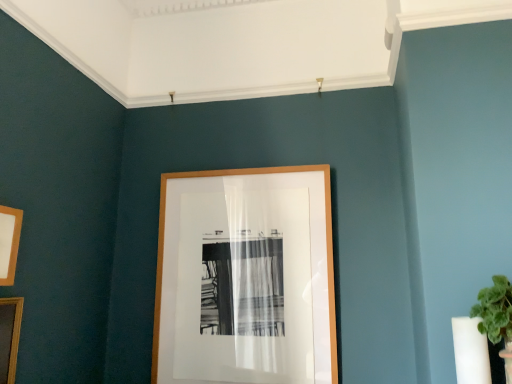
The image size is (512, 384). I want to click on wooden picture frame at left, acting as the second picture frame starting from the front, so click(9, 243).

In order to click on wooden picture frame at left, the 2th picture frame in the left-to-right sequence in this screenshot , I will do `click(9, 243)`.

Is point (2, 354) positioned before point (200, 354)?

That is True.

Is wooden picture frame at lower left, the first picture frame positioned from the left, not near wooden picture frame at center, which ranks as the 1th picture frame in back-to-front order?

wooden picture frame at lower left, the first picture frame positioned from the left, is actually quite close to wooden picture frame at center, which ranks as the 1th picture frame in back-to-front order.

From the image's perspective, is wooden picture frame at lower left, which appears as the 3th picture frame when viewed from the right, below wooden picture frame at center, the 1th picture frame viewed from the right?

Yes, from the image's perspective, wooden picture frame at lower left, which appears as the 3th picture frame when viewed from the right, is below wooden picture frame at center, the 1th picture frame viewed from the right.

Looking at the image, does wooden picture frame at lower left, which appears as the 3th picture frame when viewed from the right, seem bigger or smaller compared to wooden picture frame at center, which ranks as the 1th picture frame in back-to-front order?

Clearly, wooden picture frame at lower left, which appears as the 3th picture frame when viewed from the right, is smaller in size than wooden picture frame at center, which ranks as the 1th picture frame in back-to-front order.

From the image's perspective, starting from the wooden picture frame at lower left, the first picture frame positioned from the left, which picture frame is the 1st one above? Please provide its 2D coordinates.

[(245, 278)]

From the image's perspective, is wooden picture frame at center, the 1th picture frame viewed from the right, located beneath wooden picture frame at lower left, which appears as the 3th picture frame when viewed from the right?

Incorrect, from the image's perspective, wooden picture frame at center, the 1th picture frame viewed from the right, is higher than wooden picture frame at lower left, which appears as the 3th picture frame when viewed from the right.

Consider the image. From a real-world perspective, who is located lower, wooden picture frame at center, which ranks as the 1th picture frame in back-to-front order, or wooden picture frame at lower left, which is the first picture frame from front to back?

In real-world perspective, wooden picture frame at lower left, which is the first picture frame from front to back, is lower.

From the image's perspective, is wooden picture frame at center, marked as the 3th picture frame in a front-to-back arrangement, over wooden picture frame at left, acting as the second picture frame starting from the back?

No, from the image's perspective, wooden picture frame at center, marked as the 3th picture frame in a front-to-back arrangement, is not above wooden picture frame at left, acting as the second picture frame starting from the back.

Based on the photo, is wooden picture frame at left, the 2th picture frame in the left-to-right sequence, at the back of wooden picture frame at center, positioned as the third picture frame in left-to-right order?

No, wooden picture frame at center, positioned as the third picture frame in left-to-right order, is not facing the opposite direction of wooden picture frame at left, the 2th picture frame in the left-to-right sequence.

Is wooden picture frame at center, which ranks as the 1th picture frame in back-to-front order, to the left of wooden picture frame at left, the 2th picture frame in the left-to-right sequence, from the viewer's perspective?

Incorrect, wooden picture frame at center, which ranks as the 1th picture frame in back-to-front order, is not on the left side of wooden picture frame at left, the 2th picture frame in the left-to-right sequence.

Based on the photo, is wooden picture frame at center, the 1th picture frame viewed from the right, surrounding wooden picture frame at left, acting as the second picture frame starting from the front?

No.

From the image's perspective, is wooden picture frame at left, acting as the second picture frame starting from the front, above wooden picture frame at center, positioned as the third picture frame in left-to-right order?

Indeed, from the image's perspective, wooden picture frame at left, acting as the second picture frame starting from the front, is shown above wooden picture frame at center, positioned as the third picture frame in left-to-right order.

From a real-world perspective, which is physically above, wooden picture frame at left, the 2th picture frame in the left-to-right sequence, or wooden picture frame at center, which ranks as the 1th picture frame in back-to-front order?

In real-world perspective, wooden picture frame at left, the 2th picture frame in the left-to-right sequence, is above.

This screenshot has width=512, height=384. In the image, there is a wooden picture frame at center, positioned as the third picture frame in left-to-right order. In order to click on picture frame above it (from the image's perspective) in this screenshot , I will do `click(9, 243)`.

Considering the positions of point (21, 218) and point (294, 254), is point (21, 218) closer or farther from the camera than point (294, 254)?

Clearly, point (21, 218) is closer to the camera than point (294, 254).

From a real-world perspective, who is located lower, wooden picture frame at left, which is the second picture frame in right-to-left order, or wooden picture frame at lower left, the first picture frame positioned from the left?

wooden picture frame at lower left, the first picture frame positioned from the left.

Considering the relative positions of wooden picture frame at left, which is the second picture frame in right-to-left order, and wooden picture frame at lower left, which appears as the 3th picture frame when viewed from the right, in the image provided, is wooden picture frame at left, which is the second picture frame in right-to-left order, behind wooden picture frame at lower left, which appears as the 3th picture frame when viewed from the right,?

Yes, the depth of wooden picture frame at left, which is the second picture frame in right-to-left order, is greater than that of wooden picture frame at lower left, which appears as the 3th picture frame when viewed from the right.

Which is more to the right, wooden picture frame at left, acting as the second picture frame starting from the back, or wooden picture frame at lower left, which appears as the 3th picture frame when viewed from the right?

From the viewer's perspective, wooden picture frame at left, acting as the second picture frame starting from the back, appears more on the right side.

Are wooden picture frame at left, acting as the second picture frame starting from the front, and wooden picture frame at lower left, which is counted as the 3th picture frame, starting from the back, far apart?

No, wooden picture frame at left, acting as the second picture frame starting from the front, is in close proximity to wooden picture frame at lower left, which is counted as the 3th picture frame, starting from the back.

Would you say wooden picture frame at lower left, which is the first picture frame from front to back, is outside wooden picture frame at left, acting as the second picture frame starting from the front?

Yes, wooden picture frame at lower left, which is the first picture frame from front to back, is located beyond the bounds of wooden picture frame at left, acting as the second picture frame starting from the front.

From a real-world perspective, is wooden picture frame at lower left, which is the first picture frame from front to back, below wooden picture frame at left, the 2th picture frame in the left-to-right sequence?

Yes, from a real-world perspective, wooden picture frame at lower left, which is the first picture frame from front to back, is under wooden picture frame at left, the 2th picture frame in the left-to-right sequence.

Considering the sizes of objects wooden picture frame at lower left, which is the first picture frame from front to back, and wooden picture frame at left, which is the second picture frame in right-to-left order, in the image provided, who is taller, wooden picture frame at lower left, which is the first picture frame from front to back, or wooden picture frame at left, which is the second picture frame in right-to-left order,?

Standing taller between the two is wooden picture frame at lower left, which is the first picture frame from front to back.

In the scene shown: Can you confirm if wooden picture frame at lower left, which appears as the 3th picture frame when viewed from the right, is positioned to the right of wooden picture frame at left, the 2th picture frame in the left-to-right sequence?

No.

Find the location of `picture frame below the wooden picture frame at center, positioned as the third picture frame in left-to-right order (from a real-world perspective)`. picture frame below the wooden picture frame at center, positioned as the third picture frame in left-to-right order (from a real-world perspective) is located at coordinates (9, 337).

Find the location of a particular element. The height and width of the screenshot is (384, 512). the 2nd picture frame to the right of the wooden picture frame at lower left, which is counted as the 3th picture frame, starting from the back, starting your count from the anchor is located at coordinates (245, 278).

When comparing their distances from wooden picture frame at lower left, which is counted as the 3th picture frame, starting from the back, does wooden picture frame at center, marked as the 3th picture frame in a front-to-back arrangement, or wooden picture frame at left, the 2th picture frame in the left-to-right sequence, seem further?

wooden picture frame at center, marked as the 3th picture frame in a front-to-back arrangement, is positioned further to the anchor wooden picture frame at lower left, which is counted as the 3th picture frame, starting from the back.

From the image, which object appears to be farther from wooden picture frame at left, acting as the second picture frame starting from the back, wooden picture frame at lower left, which is counted as the 3th picture frame, starting from the back, or wooden picture frame at center, marked as the 3th picture frame in a front-to-back arrangement?

The object further to wooden picture frame at left, acting as the second picture frame starting from the back, is wooden picture frame at center, marked as the 3th picture frame in a front-to-back arrangement.

Looking at the image, which one is located closer to wooden picture frame at lower left, the first picture frame positioned from the left, wooden picture frame at left, the 2th picture frame in the left-to-right sequence, or wooden picture frame at center, positioned as the third picture frame in left-to-right order?

wooden picture frame at left, the 2th picture frame in the left-to-right sequence.

When comparing their distances from wooden picture frame at center, positioned as the third picture frame in left-to-right order, does wooden picture frame at left, acting as the second picture frame starting from the back, or wooden picture frame at lower left, which is counted as the 3th picture frame, starting from the back, seem further?

Based on the image, wooden picture frame at left, acting as the second picture frame starting from the back, appears to be further to wooden picture frame at center, positioned as the third picture frame in left-to-right order.

From the image, which object appears to be farther from wooden picture frame at left, acting as the second picture frame starting from the back, wooden picture frame at center, which ranks as the 1th picture frame in back-to-front order, or wooden picture frame at lower left, the first picture frame positioned from the left?

wooden picture frame at center, which ranks as the 1th picture frame in back-to-front order, is positioned further to the anchor wooden picture frame at left, acting as the second picture frame starting from the back.

Which object lies further to the anchor point wooden picture frame at center, positioned as the third picture frame in left-to-right order, wooden picture frame at lower left, which is the first picture frame from front to back, or wooden picture frame at left, which is the second picture frame in right-to-left order?

Among the two, wooden picture frame at left, which is the second picture frame in right-to-left order, is located further to wooden picture frame at center, positioned as the third picture frame in left-to-right order.

Where is `picture frame located between wooden picture frame at lower left, which is the first picture frame from front to back, and wooden picture frame at center, which ranks as the 1th picture frame in back-to-front order, in the left-right direction`? This screenshot has width=512, height=384. picture frame located between wooden picture frame at lower left, which is the first picture frame from front to back, and wooden picture frame at center, which ranks as the 1th picture frame in back-to-front order, in the left-right direction is located at coordinates (9, 243).